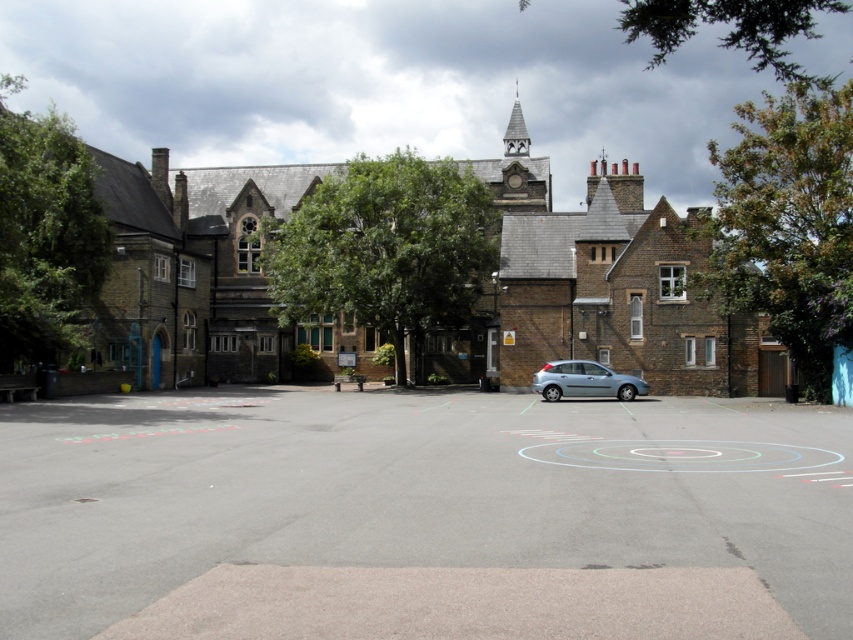
In the scene shown: You are standing at the entrance of the building and want to find the green leafy tree at left. Which direction should you look to see it?

You should look to your left because the green leafy tree at left is located at point (45, 234), which is to the left side of the scene.

You are a visitor arriving at the building and notice the green leafy tree at left and the satin silver car at center. From your perspective, which object is closer to you?

The green leafy tree at left is closer to you because it is in front of the satin silver car at center.

You are a visitor trying to park your car in the parking lot behind the green leafy tree at left and the green leafy tree at upper center. Which tree has a narrower width that might allow more space for parking?

The green leafy tree at left has a lesser width compared to the green leafy tree at upper center, so it might allow more space for parking.